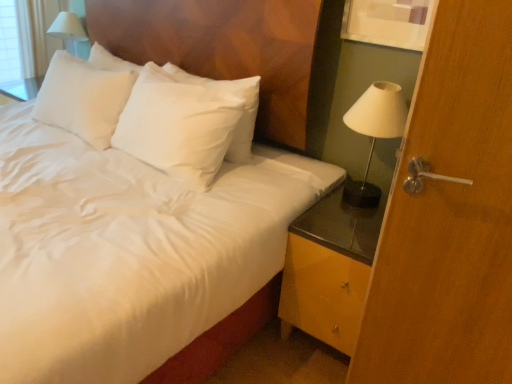
Question: Considering the relative sizes of white satin pillow at upper center and wooden door handle at right in the image provided, is white satin pillow at upper center bigger than wooden door handle at right?

Choices:
 (A) no
 (B) yes

Answer: (A)

Question: Is white satin pillow at upper center at the left side of wooden door handle at right?

Choices:
 (A) no
 (B) yes

Answer: (B)

Question: From a real-world perspective, is white satin pillow at upper center under wooden door handle at right?

Choices:
 (A) no
 (B) yes

Answer: (A)

Question: Are white satin pillow at upper center and wooden door handle at right beside each other?

Choices:
 (A) yes
 (B) no

Answer: (B)

Question: Would you consider white satin pillow at upper center to be distant from wooden door handle at right?

Choices:
 (A) no
 (B) yes

Answer: (A)

Question: From the image's perspective, is white satin bed at center positioned above or below yellow glossy nightstand at lower right?

Choices:
 (A) above
 (B) below

Answer: (A)

Question: From a real-world perspective, relative to yellow glossy nightstand at lower right, is white satin bed at center vertically above or below?

Choices:
 (A) above
 (B) below

Answer: (A)

Question: Is white satin bed at center wider or thinner than yellow glossy nightstand at lower right?

Choices:
 (A) thin
 (B) wide

Answer: (B)

Question: Is white satin bed at center bigger or smaller than yellow glossy nightstand at lower right?

Choices:
 (A) big
 (B) small

Answer: (A)

Question: From a real-world perspective, is white glossy table lamp at upper left positioned above or below wooden door handle at right?

Choices:
 (A) below
 (B) above

Answer: (B)

Question: From the image's perspective, relative to wooden door handle at right, is white glossy table lamp at upper left above or below?

Choices:
 (A) above
 (B) below

Answer: (A)

Question: Is white glossy table lamp at upper left in front of or behind wooden door handle at right in the image?

Choices:
 (A) behind
 (B) front

Answer: (A)

Question: In terms of width, does white glossy table lamp at upper left look wider or thinner when compared to wooden door handle at right?

Choices:
 (A) thin
 (B) wide

Answer: (B)

Question: Would you say yellow glossy nightstand at lower right is to the left or to the right of white glossy lamp at right in the picture?

Choices:
 (A) right
 (B) left

Answer: (B)

Question: Is yellow glossy nightstand at lower right wider or thinner than white glossy lamp at right?

Choices:
 (A) thin
 (B) wide

Answer: (B)